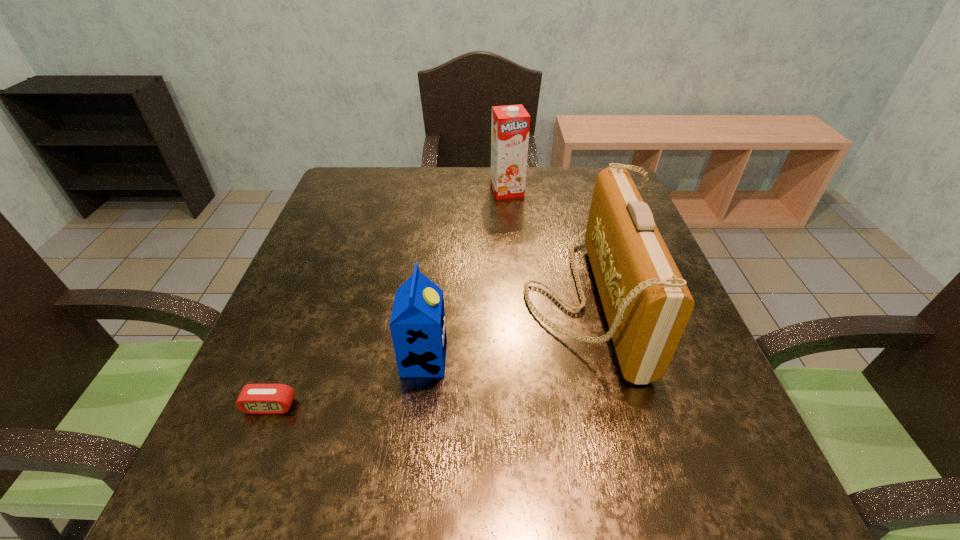
This screenshot has height=540, width=960. Identify the location of empty space between the handbag and the shorter carton. (505, 328).

Select which object is the closest to the handbag. Please provide its 2D coordinates. Your answer should be formatted as a tuple, i.e. [(x, y)], where the tuple contains the x and y coordinates of a point satisfying the conditions above.

[(418, 329)]

Locate an element on the screen. The image size is (960, 540). object that is the second closest to the handbag is located at coordinates (510, 126).

At what (x,y) coordinates should I click in order to perform the action: click on free location that satisfies the following two spatial constraints: 1. with the cap open on the third object from right to left; 2. on the front-facing side of the leftmost object. Please return your answer as a coordinate pair (x, y). This screenshot has height=540, width=960. Looking at the image, I should click on (419, 406).

The height and width of the screenshot is (540, 960). What are the coordinates of `vacant area in the image that satisfies the following two spatial constraints: 1. on the decorative side of the handbag; 2. on the front-facing side of the nearest object` in the screenshot? It's located at (612, 406).

Where is `vacant space that satisfies the following two spatial constraints: 1. on the front side of the farther carton; 2. with the cap open on the third object from right to left`? The height and width of the screenshot is (540, 960). vacant space that satisfies the following two spatial constraints: 1. on the front side of the farther carton; 2. with the cap open on the third object from right to left is located at coordinates (522, 359).

I want to click on vacant space that satisfies the following two spatial constraints: 1. on the decorative side of the handbag; 2. on the front-facing side of the nearest object, so coord(612,406).

The height and width of the screenshot is (540, 960). Identify the location of blank area in the image that satisfies the following two spatial constraints: 1. on the decorative side of the handbag; 2. on the front-facing side of the leftmost object. (612, 406).

At what (x,y) coordinates should I click in order to perform the action: click on free spot that satisfies the following two spatial constraints: 1. with the cap open on the shorter carton; 2. on the front-facing side of the nearest object. Please return your answer as a coordinate pair (x, y). This screenshot has height=540, width=960. Looking at the image, I should click on (419, 406).